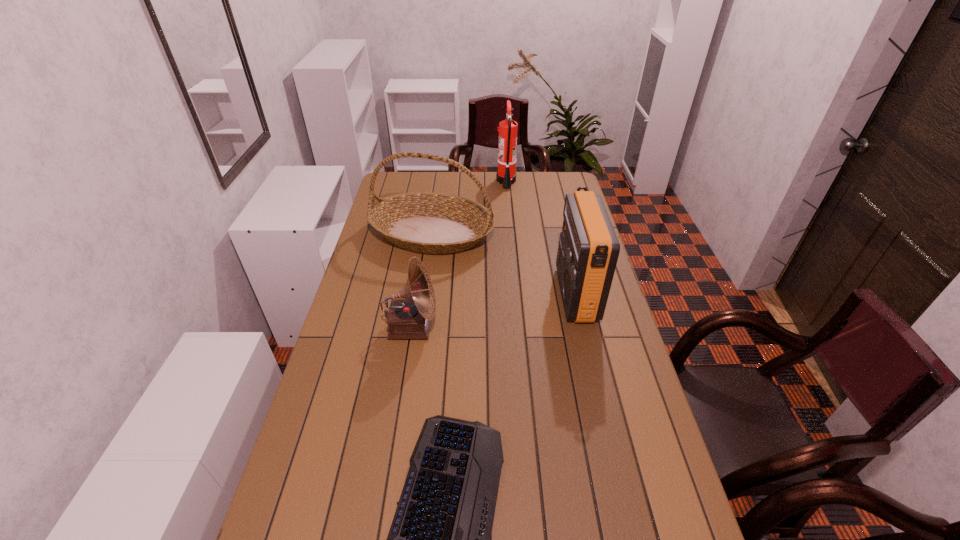
What are the coordinates of `vacant space located 0.060m on the front-facing side of the rightmost object` in the screenshot? It's located at (541, 294).

The image size is (960, 540). Identify the location of vacant space located 0.210m on the front-facing side of the rightmost object. (498, 294).

Where is `vacant area situated 0.290m on the horn of the second shortest object`? Image resolution: width=960 pixels, height=540 pixels. vacant area situated 0.290m on the horn of the second shortest object is located at coordinates (528, 328).

I want to click on object located in the far edge section of the desktop, so click(x=506, y=175).

Find the location of a particular element. This screenshot has height=540, width=960. basket present at the left edge is located at coordinates (425, 222).

Find the location of a particular element. The image size is (960, 540). phonograph record located at the left edge is located at coordinates (409, 318).

Image resolution: width=960 pixels, height=540 pixels. Find the location of `object at the right edge`. object at the right edge is located at coordinates (588, 250).

Where is `free spot at the far edge of the desktop`? free spot at the far edge of the desktop is located at coordinates (531, 191).

Identify the location of free space at the left edge of the desktop. (322, 393).

Locate an element on the screen. vacant space at the right edge is located at coordinates (560, 235).